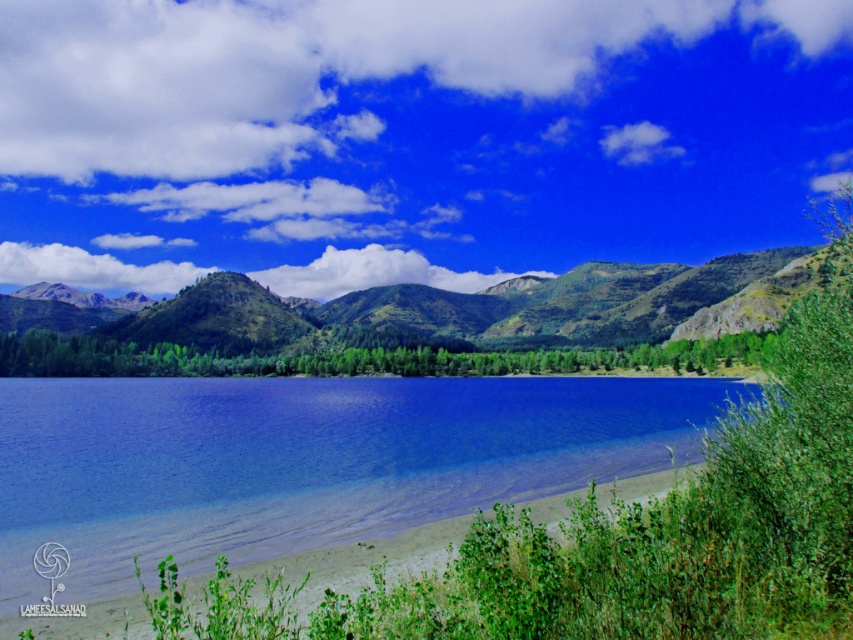
Question: Which object appears farthest from the camera in this image?

Choices:
 (A) blue glassy water at center
 (B) white fluffy cloud at upper center
 (C) green grassy hill at center

Answer: (B)

Question: Is white fluffy cloud at upper center closer to the viewer compared to green grassy hill at center?

Choices:
 (A) no
 (B) yes

Answer: (A)

Question: Which object is the farthest from the white fluffy cloud at center?

Choices:
 (A) blue glassy water at center
 (B) green grassy hill at center

Answer: (A)

Question: Does white fluffy cloud at upper center have a lesser width compared to white fluffy cloud at center?

Choices:
 (A) no
 (B) yes

Answer: (A)

Question: Among these points, which one is farthest from the camera?

Choices:
 (A) (450, 280)
 (B) (378, 403)
 (C) (212, 13)
 (D) (759, 298)

Answer: (C)

Question: Can you confirm if blue glassy water at center is wider than green grassy hill at center?

Choices:
 (A) no
 (B) yes

Answer: (A)